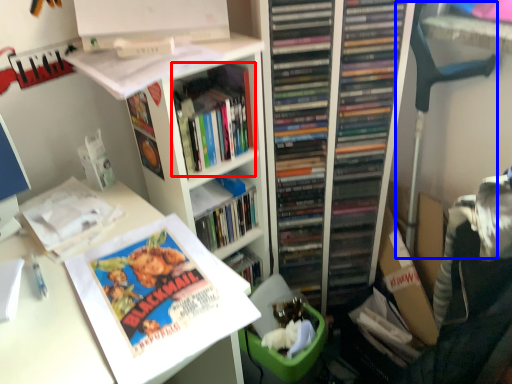
Question: Among these objects, which one is farthest to the camera, book (highlighted by a red box) or computer chair (highlighted by a blue box)?

Choices:
 (A) book
 (B) computer chair

Answer: (B)